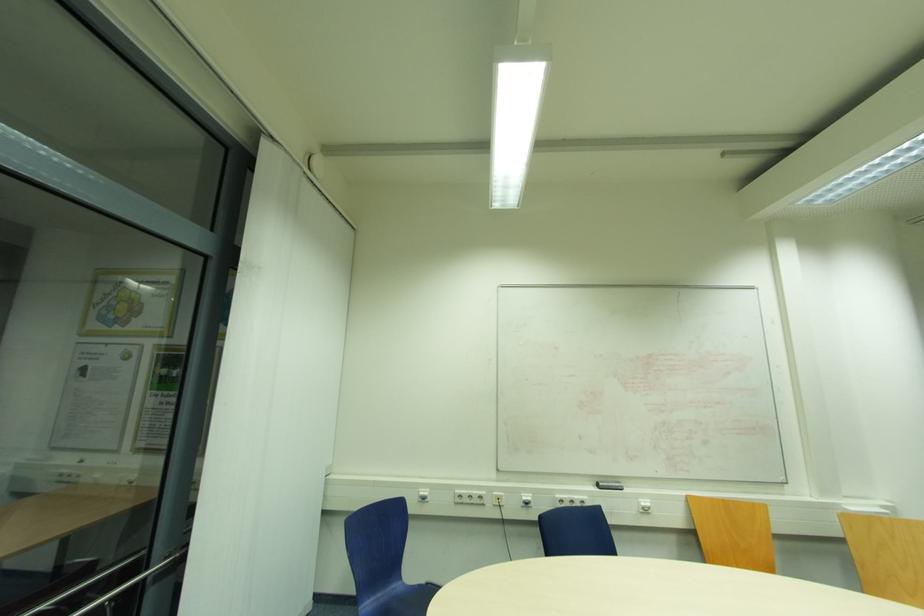
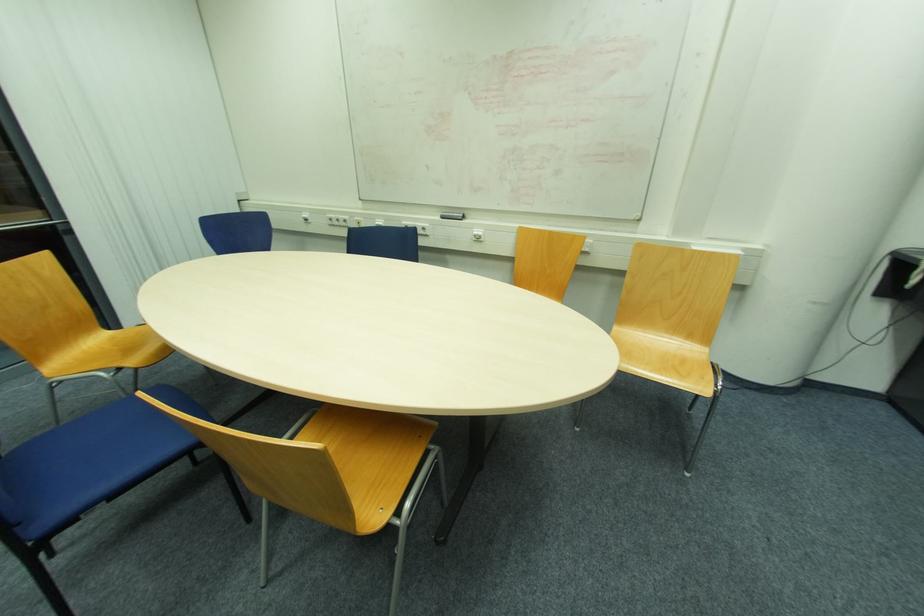
In the second image, find the point that corresponds to [645,505] in the first image.

(477, 233)